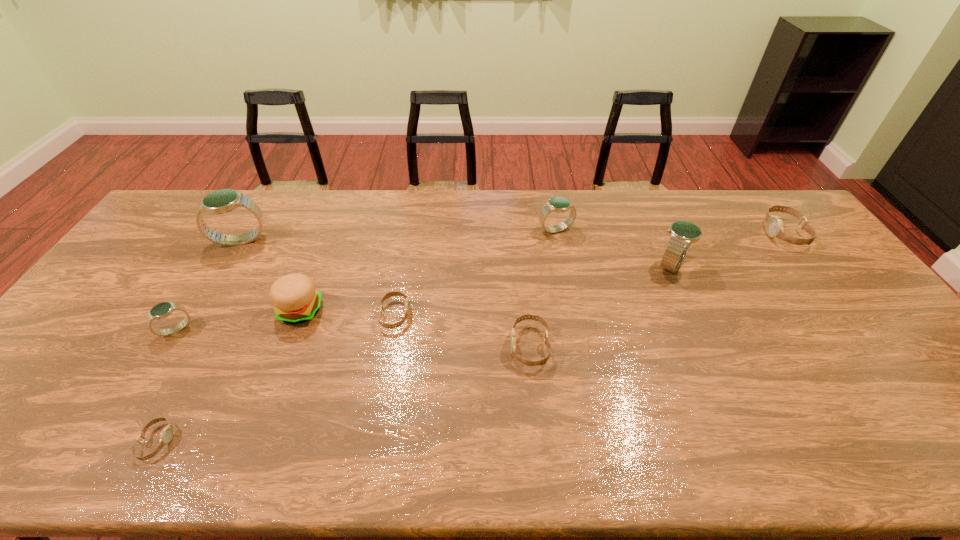
Identify the location of object at the near edge. The image size is (960, 540). (166, 435).

You are a GUI agent. You are given a task and a screenshot of the screen. Output one action in this format:
    pyautogui.click(x=<x>, y=<y>)
    Task: Click on the object located in the right edge section of the desktop
    This screenshot has width=960, height=540.
    Given the screenshot: What is the action you would take?
    pyautogui.click(x=774, y=225)

Identify the location of object positioned at the far right corner. The width and height of the screenshot is (960, 540). (774, 225).

The height and width of the screenshot is (540, 960). In the image, there is a desktop. Identify the location of vacant space at the far edge. (609, 227).

Image resolution: width=960 pixels, height=540 pixels. What are the coordinates of `free space at the near edge of the desktop` in the screenshot? It's located at (137, 468).

The height and width of the screenshot is (540, 960). In order to click on vacant area at the left edge in this screenshot , I will do `click(58, 418)`.

Locate an element on the screen. vacant area at the far left corner of the desktop is located at coordinates (183, 213).

You are a GUI agent. You are given a task and a screenshot of the screen. Output one action in this format:
    pyautogui.click(x=<x>, y=<y>)
    Task: Click on the free space at the near left corner
    This screenshot has height=540, width=960.
    Given the screenshot: What is the action you would take?
    pyautogui.click(x=41, y=446)

Where is `blank region between the fourth object from left to right and the nearest blue watch`? Image resolution: width=960 pixels, height=540 pixels. blank region between the fourth object from left to right and the nearest blue watch is located at coordinates (238, 320).

The width and height of the screenshot is (960, 540). In order to click on vacant area between the fifth watch from left to right and the nearest blue watch in this screenshot , I will do `click(353, 338)`.